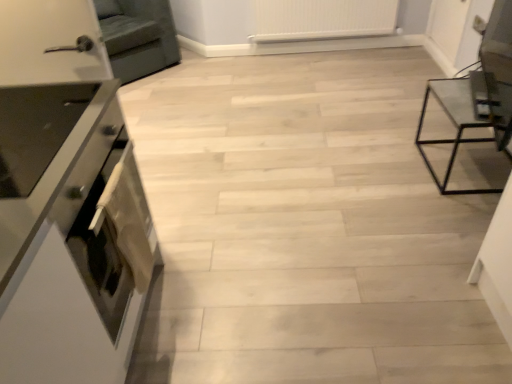
Describe the element at coordinates (138, 36) in the screenshot. The image size is (512, 384). I see `dark gray fabric armchair at upper left` at that location.

Identify the location of satin silver oven at left. This screenshot has height=384, width=512. (114, 237).

Which of these two, satin silver oven at left or white plastic radiator at upper center, is thinner?

satin silver oven at left is thinner.

Does point (137, 178) lie behind point (255, 7)?

No, it is in front of (255, 7).

Is satin silver oven at left oriented away from white plastic radiator at upper center?

No, satin silver oven at left's orientation is not away from white plastic radiator at upper center.

From the image's perspective, is satin silver oven at left over dark gray fabric armchair at upper left?

No, from the image's perspective, satin silver oven at left is not above dark gray fabric armchair at upper left.

Is satin silver oven at left next to dark gray fabric armchair at upper left and touching it?

No, satin silver oven at left is not next to dark gray fabric armchair at upper left.

Considering the relative positions of satin silver oven at left and dark gray fabric armchair at upper left in the image provided, is satin silver oven at left to the left of dark gray fabric armchair at upper left from the viewer's perspective?

In fact, satin silver oven at left is to the right of dark gray fabric armchair at upper left.

Who is shorter, transparent glass table at right or white plastic radiator at upper center?

white plastic radiator at upper center.

Considering the sizes of objects transparent glass table at right and white plastic radiator at upper center in the image provided, who is wider, transparent glass table at right or white plastic radiator at upper center?

transparent glass table at right.

From the image's perspective, is transparent glass table at right under white plastic radiator at upper center?

Correct, transparent glass table at right appears lower than white plastic radiator at upper center in the image.

Are transparent glass table at right and white plastic radiator at upper center making contact?

They are not placed beside each other.

From a real-world perspective, between white glossy oven at left and white plastic radiator at upper center, who is vertically lower?

In real-world perspective, white plastic radiator at upper center is lower.

Is white glossy oven at left positioned beyond the bounds of white plastic radiator at upper center?

Yes, white glossy oven at left is outside of white plastic radiator at upper center.

From the picture: Considering the sizes of objects white glossy oven at left and white plastic radiator at upper center in the image provided, who is shorter, white glossy oven at left or white plastic radiator at upper center?

Standing shorter between the two is white plastic radiator at upper center.

Between point (10, 304) and point (378, 7), which one is positioned in front?

The point (10, 304) is closer.

Does transparent glass table at right appear on the left side of satin silver oven at left?

In fact, transparent glass table at right is to the right of satin silver oven at left.

Considering the positions of point (440, 189) and point (84, 230), is point (440, 189) closer or farther from the camera than point (84, 230)?

Point (440, 189) is farther from the camera than point (84, 230).

In the scene shown: Which object is wider, transparent glass table at right or satin silver oven at left?

transparent glass table at right is wider.

From the image's perspective, which one is positioned higher, satin silver oven at left or transparent glass table at right?

transparent glass table at right, from the image's perspective.

Between satin silver oven at left and transparent glass table at right, which one is positioned behind?

transparent glass table at right is behind.

In the scene shown: Which of these two, satin silver oven at left or transparent glass table at right, is thinner?

With smaller width is satin silver oven at left.

Between satin silver oven at left and transparent glass table at right, which one has larger size?

transparent glass table at right is bigger.

Is dark gray fabric armchair at upper left located within white plastic radiator at upper center?

No, dark gray fabric armchair at upper left is not a part of white plastic radiator at upper center.

Is point (341, 16) positioned behind point (116, 35)?

Yes, point (341, 16) is behind point (116, 35).

Is white plastic radiator at upper center shorter than dark gray fabric armchair at upper left?

Indeed, white plastic radiator at upper center has a lesser height compared to dark gray fabric armchair at upper left.

Where is `oven on the left of the white plastic radiator at upper center`? The image size is (512, 384). oven on the left of the white plastic radiator at upper center is located at coordinates (114, 237).

Find the location of `oven in front of the dark gray fabric armchair at upper left`. oven in front of the dark gray fabric armchair at upper left is located at coordinates (114, 237).

From the image, which object appears to be farther from transparent glass table at right, white glossy oven at left or satin silver oven at left?

The object further to transparent glass table at right is white glossy oven at left.

From the image, which object appears to be nearer to satin silver oven at left, white plastic radiator at upper center or transparent glass table at right?

transparent glass table at right is positioned closer to the anchor satin silver oven at left.

Looking at the image, which one is located closer to white glossy oven at left, dark gray fabric armchair at upper left or satin silver oven at left?

satin silver oven at left lies closer to white glossy oven at left than the other object.

Estimate the real-world distances between objects in this image. Which object is further from white plastic radiator at upper center, white glossy oven at left or transparent glass table at right?

white glossy oven at left lies further to white plastic radiator at upper center than the other object.

Based on their spatial positions, is white glossy oven at left or white plastic radiator at upper center closer to dark gray fabric armchair at upper left?

white plastic radiator at upper center.

Based on their spatial positions, is white plastic radiator at upper center or white glossy oven at left further from satin silver oven at left?

The object further to satin silver oven at left is white plastic radiator at upper center.

Based on their spatial positions, is transparent glass table at right or white glossy oven at left closer to white plastic radiator at upper center?

Based on the image, transparent glass table at right appears to be nearer to white plastic radiator at upper center.

Looking at the image, which one is located further to satin silver oven at left, dark gray fabric armchair at upper left or transparent glass table at right?

dark gray fabric armchair at upper left lies further to satin silver oven at left than the other object.

In order to click on oven between dark gray fabric armchair at upper left and transparent glass table at right from left to right in this screenshot , I will do `click(114, 237)`.

Find the location of a particular element. This screenshot has height=384, width=512. furniture between white glossy oven at left and white plastic radiator at upper center from front to back is located at coordinates (453, 124).

Locate an element on the screen. armchair between white glossy oven at left and white plastic radiator at upper center along the z-axis is located at coordinates (x=138, y=36).

At what (x,y) coordinates should I click in order to perform the action: click on cabinetry located between dark gray fabric armchair at upper left and transparent glass table at right in the left-right direction. Please return your answer as a coordinate pair (x, y). Image resolution: width=512 pixels, height=384 pixels. Looking at the image, I should click on (77, 258).